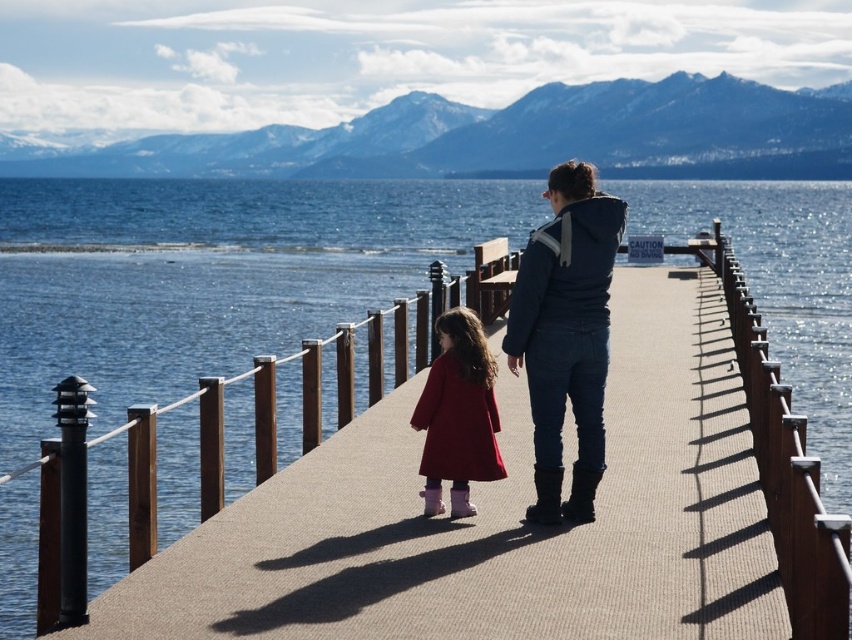
Which is behind, point (289, 416) or point (430, 456)?

The point (289, 416) is behind.

Is blue water at center to the right of matte red coat at center from the viewer's perspective?

Incorrect, blue water at center is not on the right side of matte red coat at center.

Locate an element on the screen. blue water at center is located at coordinates (206, 275).

Does blue water at center have a greater height compared to denim jacket at center?

Correct, blue water at center is much taller as denim jacket at center.

Can you confirm if blue water at center is positioned below denim jacket at center?

No, blue water at center is not below denim jacket at center.

Is point (16, 284) behind point (550, 205)?

Yes, it is behind point (550, 205).

Where is `blue water at center`? The image size is (852, 640). blue water at center is located at coordinates (206, 275).

Is point (542, 472) positioned after point (486, 420)?

No, it is in front of (486, 420).

How much distance is there between denim jacket at center and matte red coat at center?

denim jacket at center and matte red coat at center are 69.02 centimeters apart.

The image size is (852, 640). What do you see at coordinates (565, 333) in the screenshot?
I see `denim jacket at center` at bounding box center [565, 333].

What are the coordinates of `denim jacket at center` in the screenshot? It's located at (565, 333).